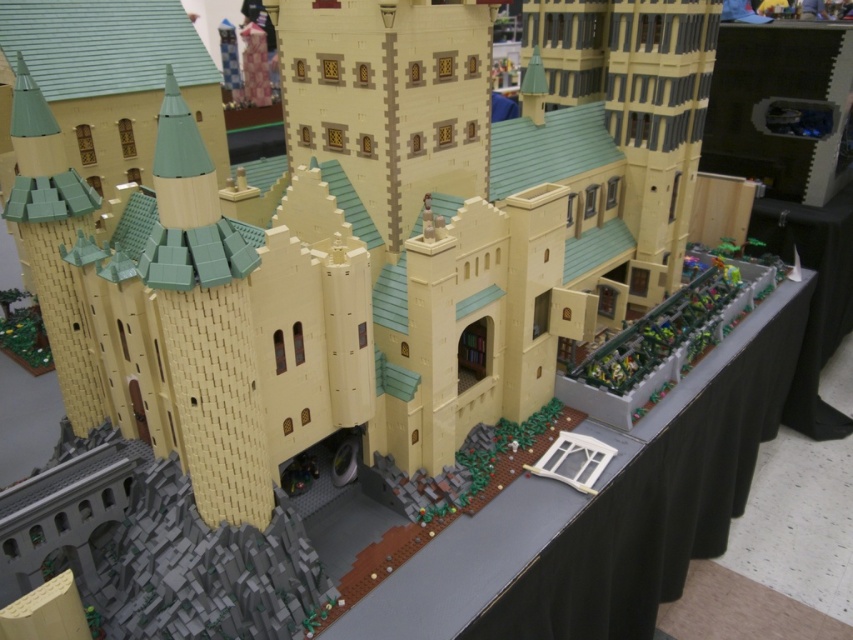
Who is positioned more to the left, light yellow brick castle at center or black fabric table at center?

From the viewer's perspective, light yellow brick castle at center appears more on the left side.

Is light yellow brick castle at center behind black fabric table at center?

No, light yellow brick castle at center is closer to the viewer.

Who is more forward, (577, 154) or (672, 397)?

Point (672, 397) is more forward.

Image resolution: width=853 pixels, height=640 pixels. What are the coordinates of `light yellow brick castle at center` in the screenshot? It's located at (368, 240).